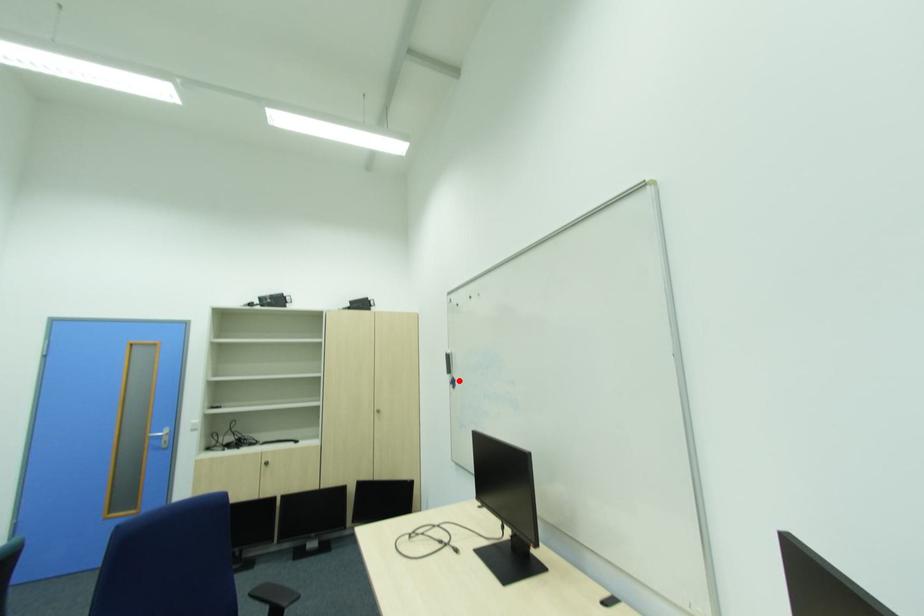
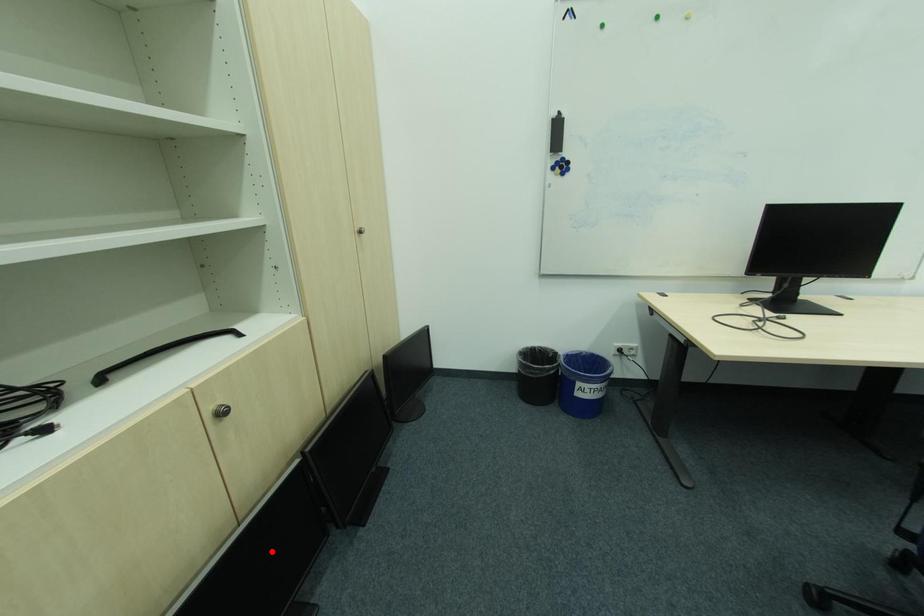
I am providing you with two images of the same scene from different viewpoints. A red point is marked on the first image and another point is marked on the second image. Is the marked point in image1 the same physical position as the marked point in image2?

No